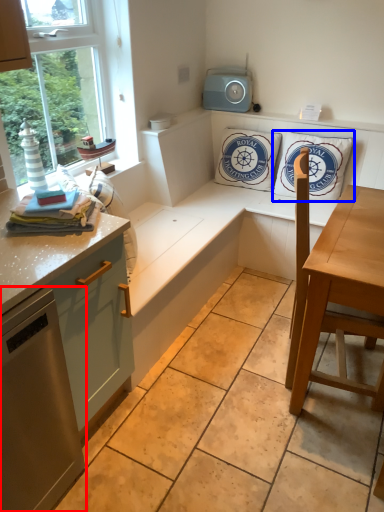
Question: Which object appears farthest to the camera in this image, appliance (highlighted by a red box) or pillow (highlighted by a blue box)?

Choices:
 (A) appliance
 (B) pillow

Answer: (B)